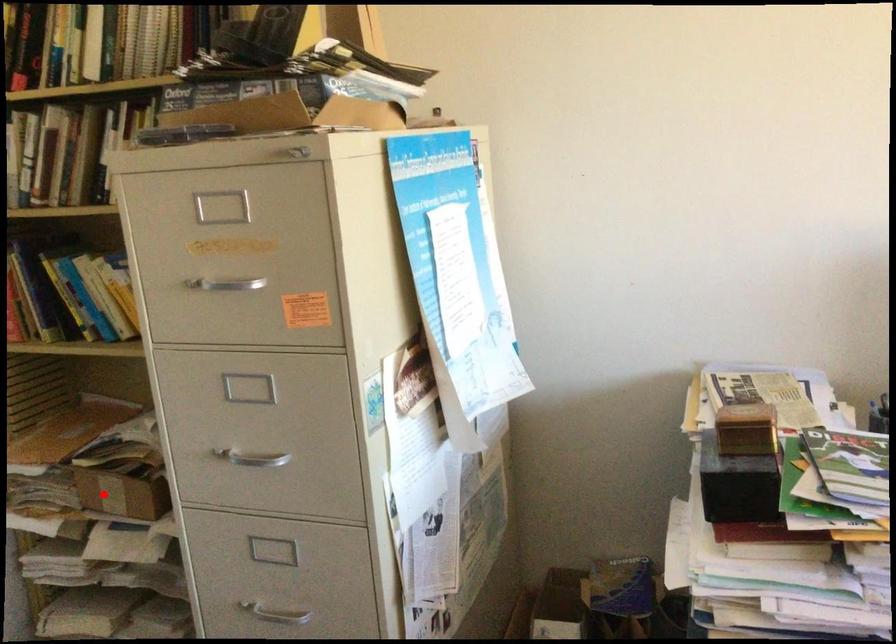
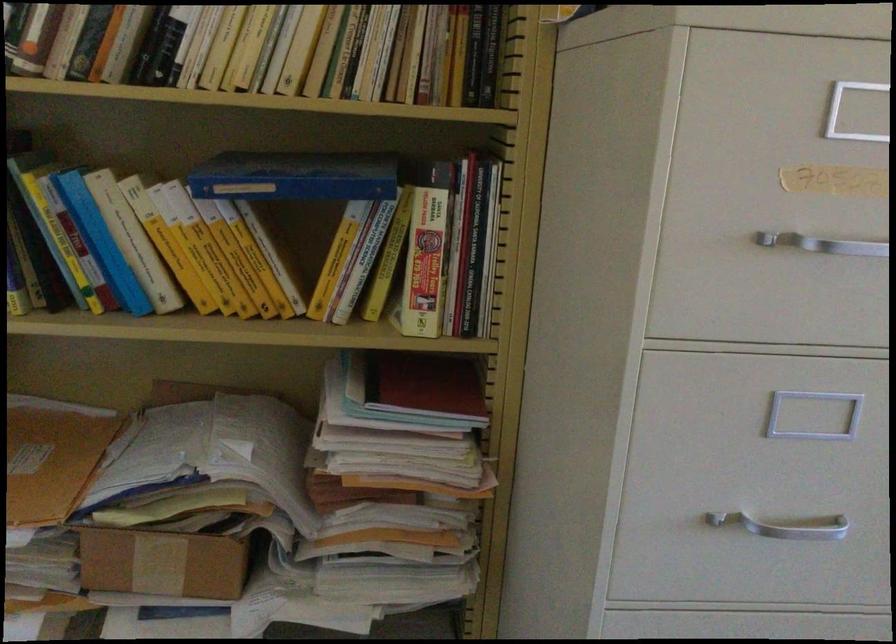
Where in the second image is the point corresponding to the highlighted location from the first image?

(161, 564)